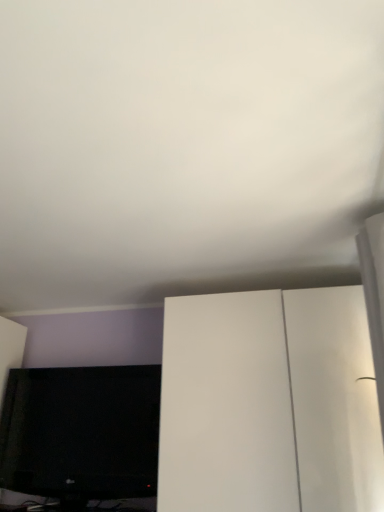
Find the location of a particular element. black glossy tv at lower left is located at coordinates (81, 435).

The height and width of the screenshot is (512, 384). What do you see at coordinates (81, 435) in the screenshot? I see `black glossy tv at lower left` at bounding box center [81, 435].

Locate an element on the screen. This screenshot has width=384, height=512. black glossy tv at lower left is located at coordinates (81, 435).